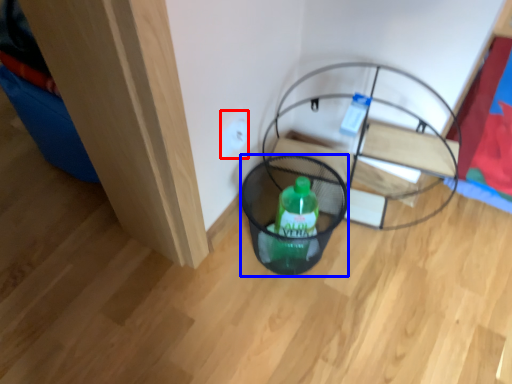
Question: Which of the following is the farthest to the observer, electric outlet (highlighted by a red box) or basket (highlighted by a blue box)?

Choices:
 (A) electric outlet
 (B) basket

Answer: (A)